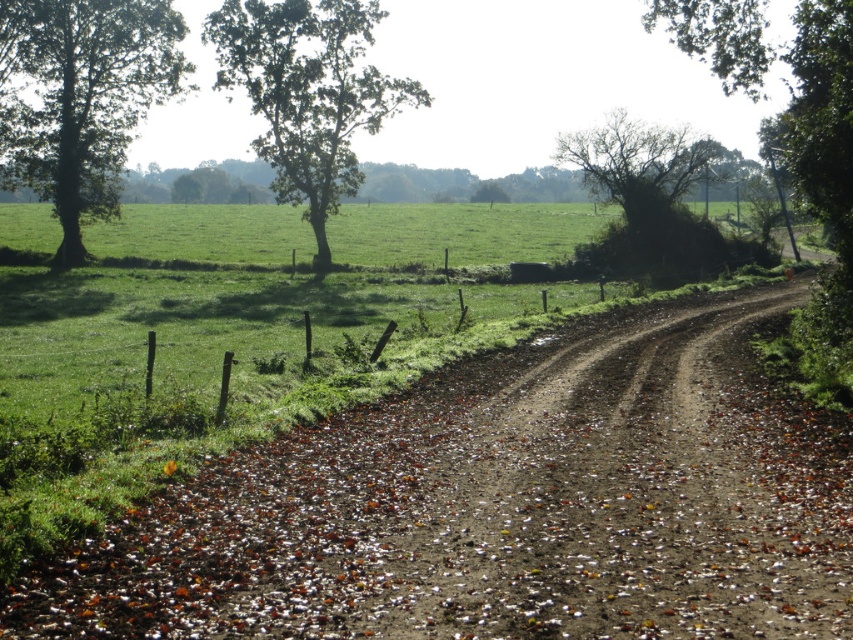
You are standing at the center of the dirt path and want to reach the green leafy tree at left. Which direction should you walk to get there?

You should walk to the left to reach the green leafy tree at left since it is located at the left side of the image.

You are a gardener who wants to mow the green grass at center and trim the green leafy tree at upper left. Which task should you do first if you want to start with the shorter object?

The green grass at center is shorter than the green leafy tree at upper left, so you should mow the green grass at center first.

In the scene shown: You are a gardener planning to mow the green grass at center and trim the green leafy tree at upper left. Considering their sizes, which task requires more time?

The green leafy tree at upper left requires more time to trim than the green grass at center since it is larger in size.